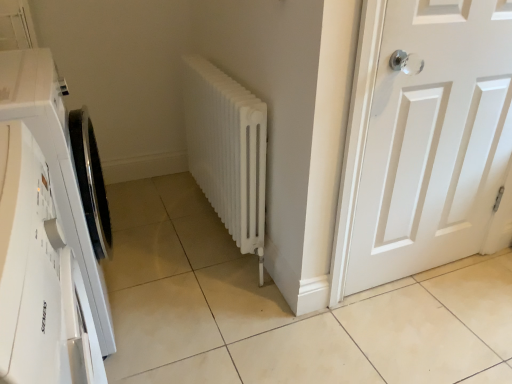
Locate an element on the screen. The image size is (512, 384). vacant point above white matte radiator at center (from a real-world perspective) is located at coordinates (210, 69).